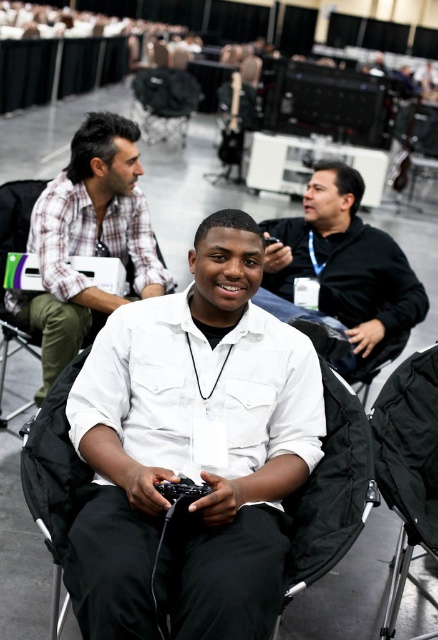
Question: Does white plaid shirt at upper left lie in front of black matte shirt at upper right?

Choices:
 (A) no
 (B) yes

Answer: (B)

Question: Which point is farther from the camera taking this photo?

Choices:
 (A) (384, 300)
 (B) (59, 268)

Answer: (A)

Question: Is white plaid shirt at upper left positioned before black matte shirt at upper right?

Choices:
 (A) no
 (B) yes

Answer: (B)

Question: Is white plaid shirt at upper left bigger than black matte shirt at upper right?

Choices:
 (A) yes
 (B) no

Answer: (A)

Question: Which of these objects is positioned closest to the white matte shirt at center?

Choices:
 (A) black fabric chair at lower right
 (B) black matte shirt at upper right

Answer: (A)

Question: Which point is closer to the camera taking this photo?

Choices:
 (A) (282, 394)
 (B) (399, 317)
 (C) (414, 497)

Answer: (A)